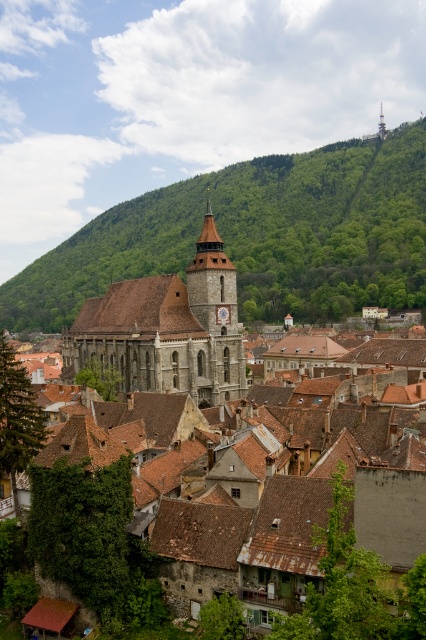
You are standing in the historic town and want to take a photo of the brown stone church at center and the gray stone clock tower at center. Which one should you focus on first to ensure both are in sharp focus?

You should focus on the brown stone church at center first because it is closer to the viewer than the gray stone clock tower at center, so focusing on the closer object will help both be in focus.

You are standing in the historic town and want to take a photo of the dark gray stone church at center and the gray stone clock tower at center. Which one should you position to the left side of your camera frame to capture both structures properly?

You should position the dark gray stone church at center to the left side of your camera frame because it is already located to the left of the gray stone clock tower at center.

You are standing in the historic town and want to take a photo of the brown stone church at center. To ensure the church is centered in your shot, where should you position your camera relative to the town layout?

The brown stone church at center is located at the 2D coordinates point (229, 451), so you should position your camera at that point to center the church in your photo.